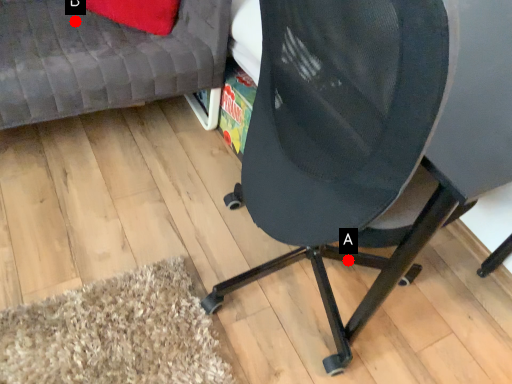
Question: Two points are circled on the image, labeled by A and B beside each circle. Which point is farther from the camera taking this photo?

Choices:
 (A) A is further
 (B) B is further

Answer: (B)